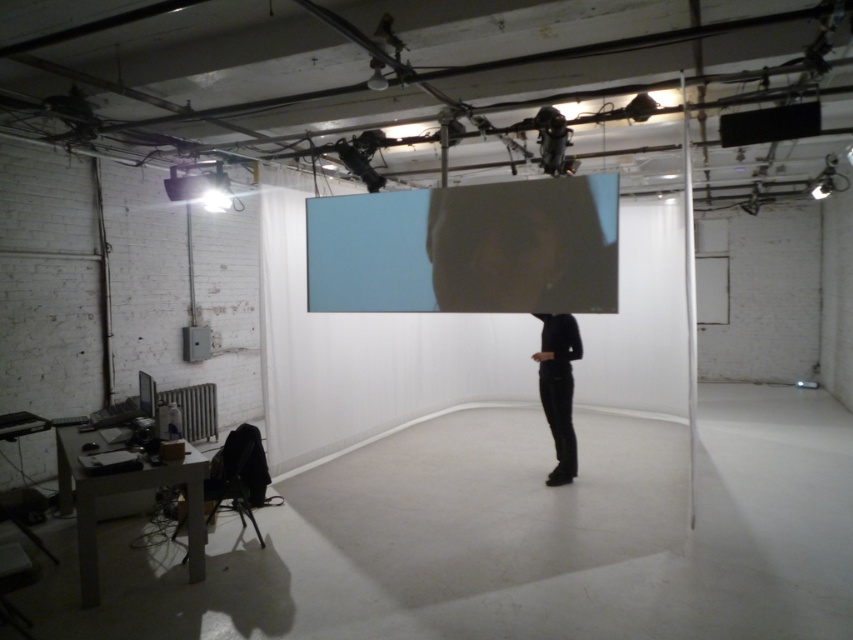
You are an art curator planning to install a new sculpture in this space. The sculpture requires a flat surface at the same height as the black matte pants at center. Is there a suitable surface available near the matte blue screen at center?

The matte blue screen at center is located above the black matte pants at center, so there is no flat surface at the same height as the black matte pants at center near the matte blue screen at center.

You are an artist standing at the entrance of the room. You need to position a new sculpture exactly where the matte blue screen at center is currently located. Can you describe the exact coordinates where you should place the sculpture?

The exact coordinates for placing the sculpture are at point (x=466, y=248), which is where the matte blue screen at center is positioned.

You are an artist setting up a video installation. You have a matte blue screen at center and black matte pants at center. According to the scene description, which object is positioned to the left?

The matte blue screen at center is positioned to the left of the black matte pants at center.